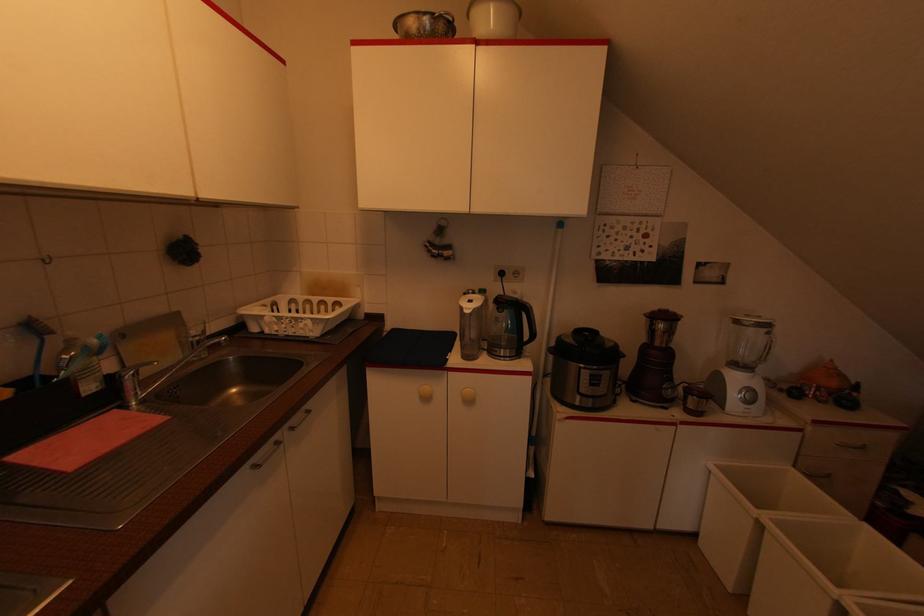
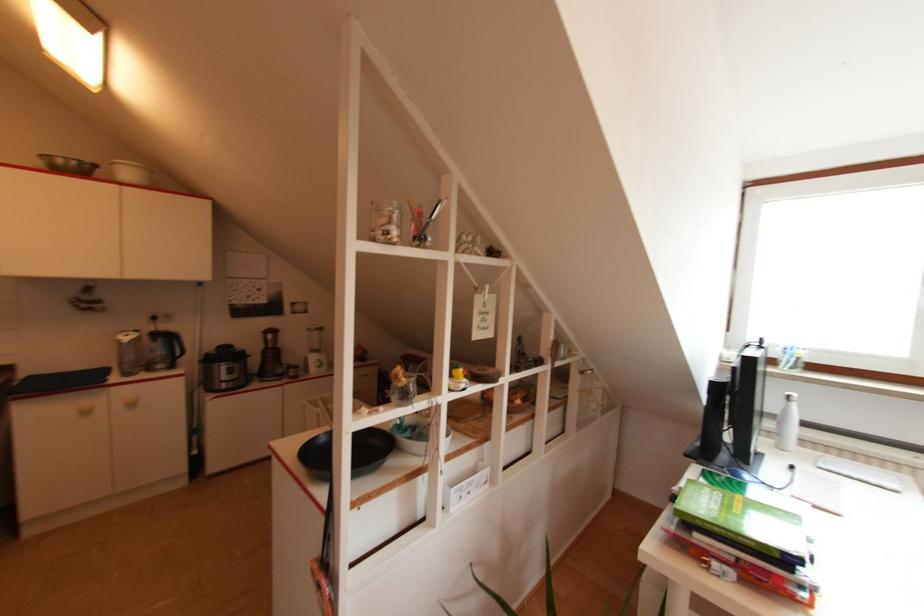
Where in the second image is the point corresponding to [570,342] from the first image?

(213, 353)